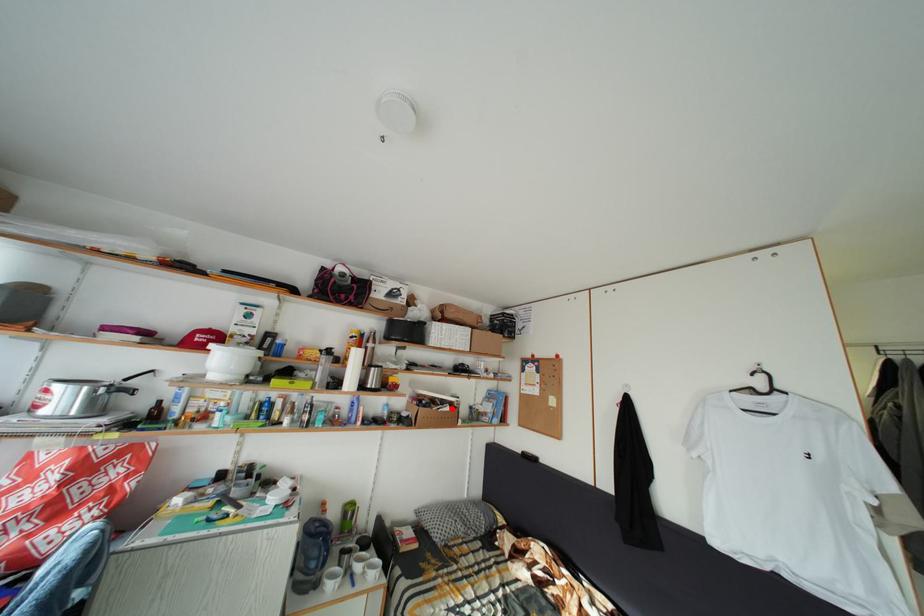
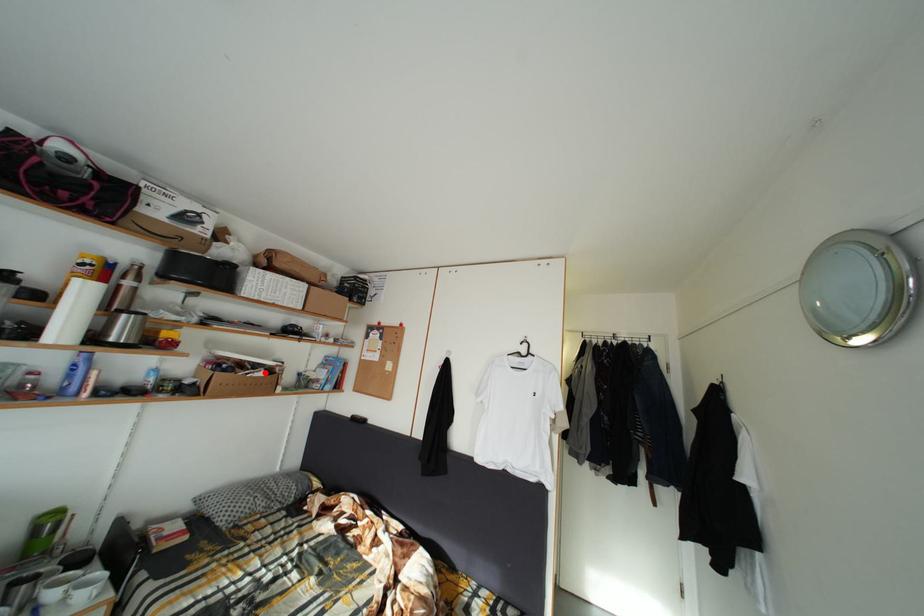
I am providing you with two images of the same scene from different viewpoints. A red point is marked on the first image and another point is marked on the second image. Is the red point in image1 aligned with the point shown in image2?

Yes